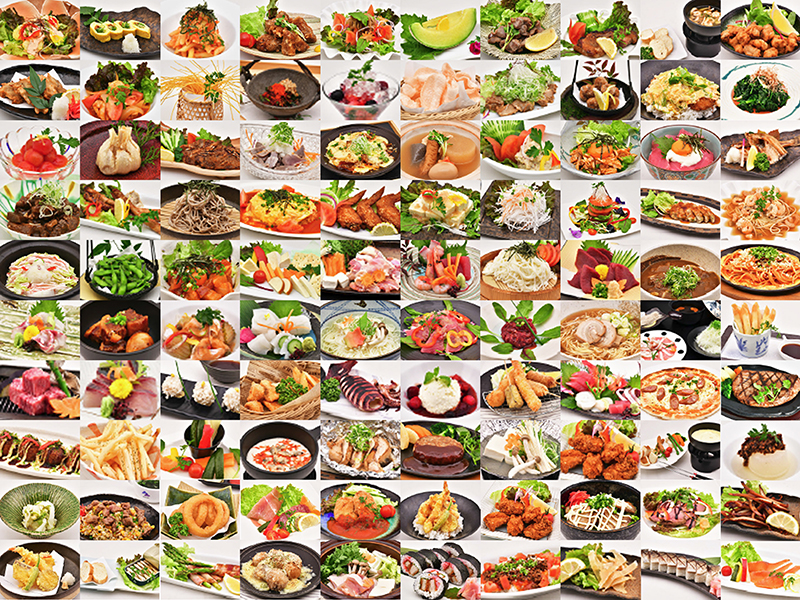
Image resolution: width=800 pixels, height=600 pixels. Identify the location of photographs in top row. (52, 31), (130, 32), (194, 32), (278, 30), (364, 30), (438, 31), (528, 29), (608, 29), (674, 29), (754, 31).